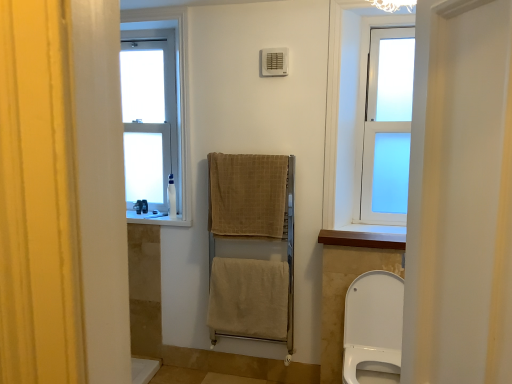
At what (x,y) coordinates should I click in order to perform the action: click on vacant space situated above beige woven towel at center, the 3th bath towel from the bottom (from a real-world perspective). Please return your answer as a coordinate pair (x, y). This screenshot has width=512, height=384. Looking at the image, I should click on (249, 156).